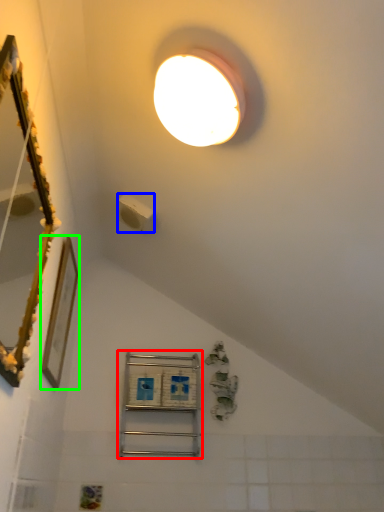
Question: Considering the real-world distances, which object is farthest from shelf (highlighted by a red box)? light switch (highlighted by a blue box) or picture frame (highlighted by a green box)?

Choices:
 (A) light switch
 (B) picture frame

Answer: (A)